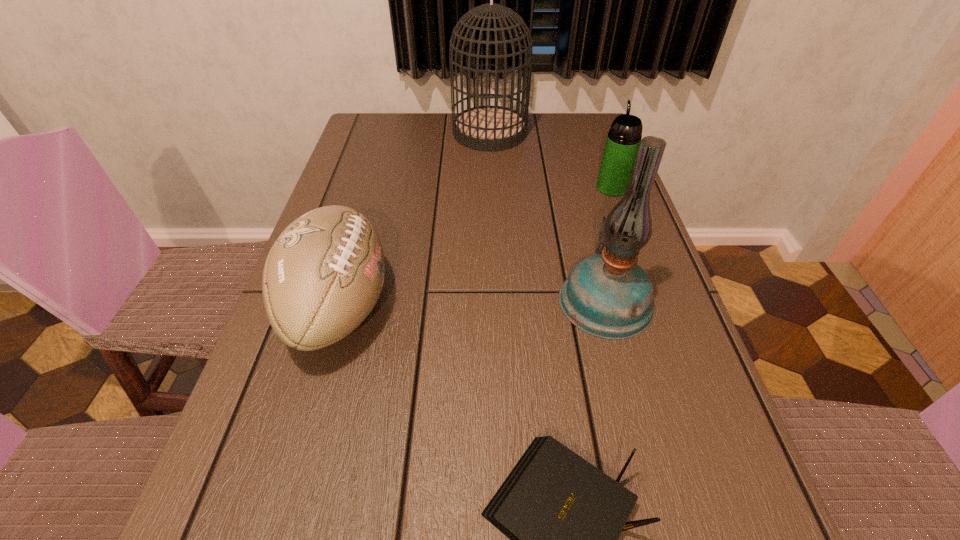
Locate an element on the screen. This screenshot has height=540, width=960. the farthest object is located at coordinates (484, 128).

This screenshot has width=960, height=540. Find the location of `birdcage`. birdcage is located at coordinates click(484, 128).

This screenshot has height=540, width=960. In order to click on the second tallest object in this screenshot , I will do `click(608, 295)`.

You are a GUI agent. You are given a task and a screenshot of the screen. Output one action in this format:
    pyautogui.click(x=<x>, y=<y>)
    Task: Click on the thermos bottle
    
    Given the screenshot: What is the action you would take?
    pyautogui.click(x=623, y=140)

At what (x,y) coordinates should I click in order to perform the action: click on the leftmost object. Please return your answer as a coordinate pair (x, y). The width and height of the screenshot is (960, 540). Looking at the image, I should click on (324, 274).

In order to click on blank space located on the left of the tallest object in this screenshot , I will do `click(410, 132)`.

The height and width of the screenshot is (540, 960). Identify the location of free space located on the back of the second tallest object. (574, 182).

Find the location of a particular element. This screenshot has height=540, width=960. vacant area located 0.250m from the spout of the second farthest object is located at coordinates (592, 132).

Where is `vacant space located from the spout of the second farthest object`? The height and width of the screenshot is (540, 960). vacant space located from the spout of the second farthest object is located at coordinates (598, 150).

Where is `vacant space located from the spout of the second farthest object`? vacant space located from the spout of the second farthest object is located at coordinates (597, 147).